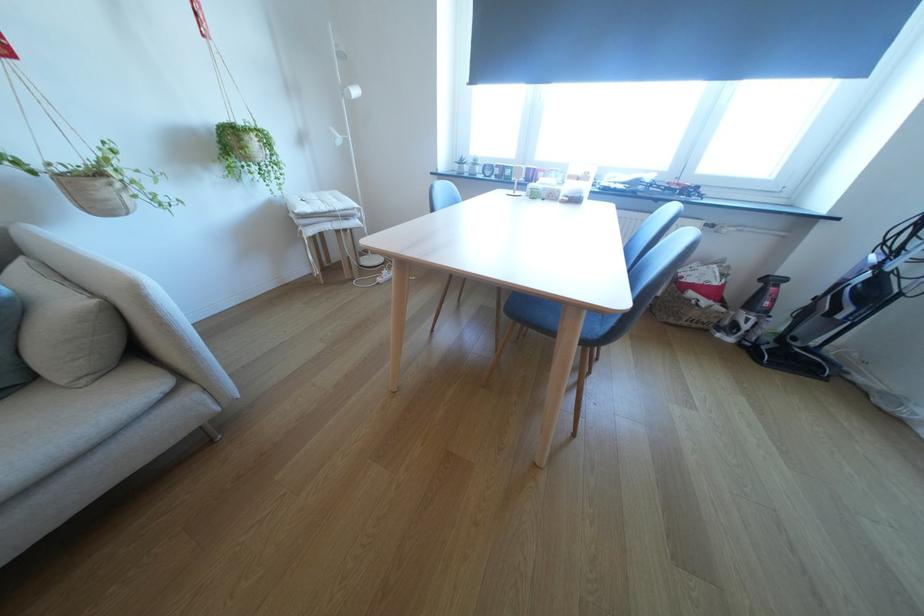
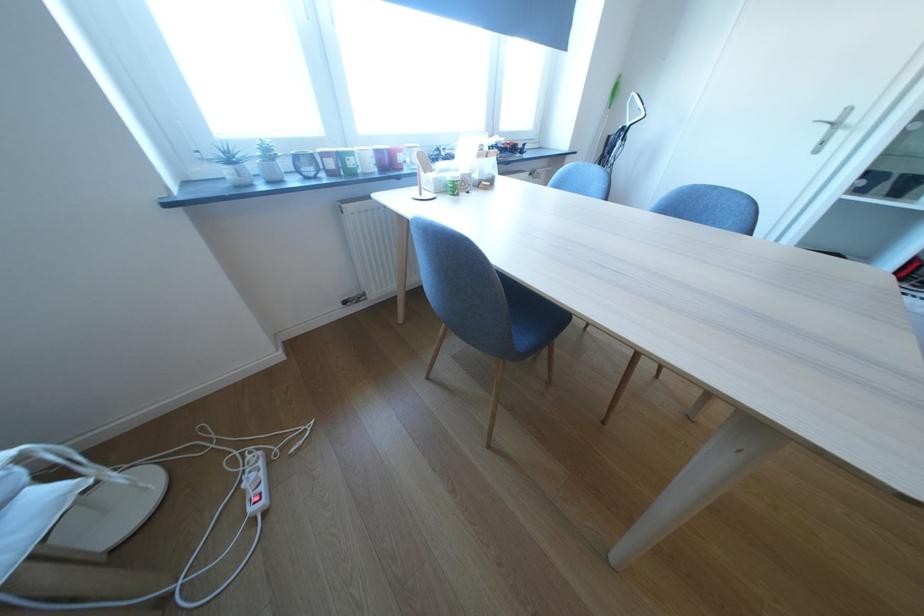
Find the pixel in the second image that matches (507,172) in the first image.

(342, 164)